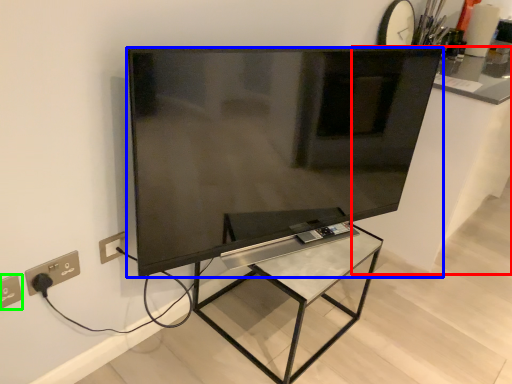
Question: Which is farther away from counter top (highlighted by a red box)? television (highlighted by a blue box) or electric outlet (highlighted by a green box)?

Choices:
 (A) television
 (B) electric outlet

Answer: (B)